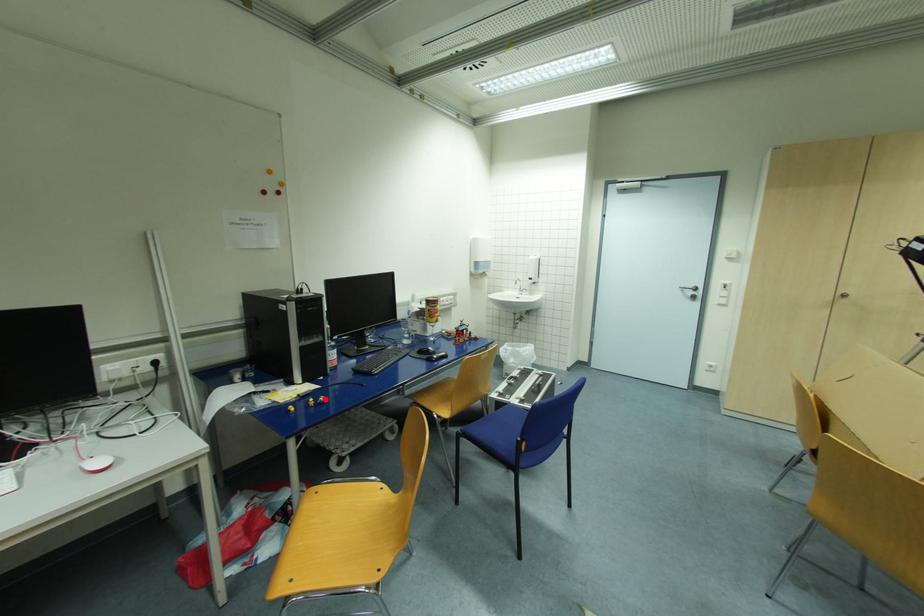
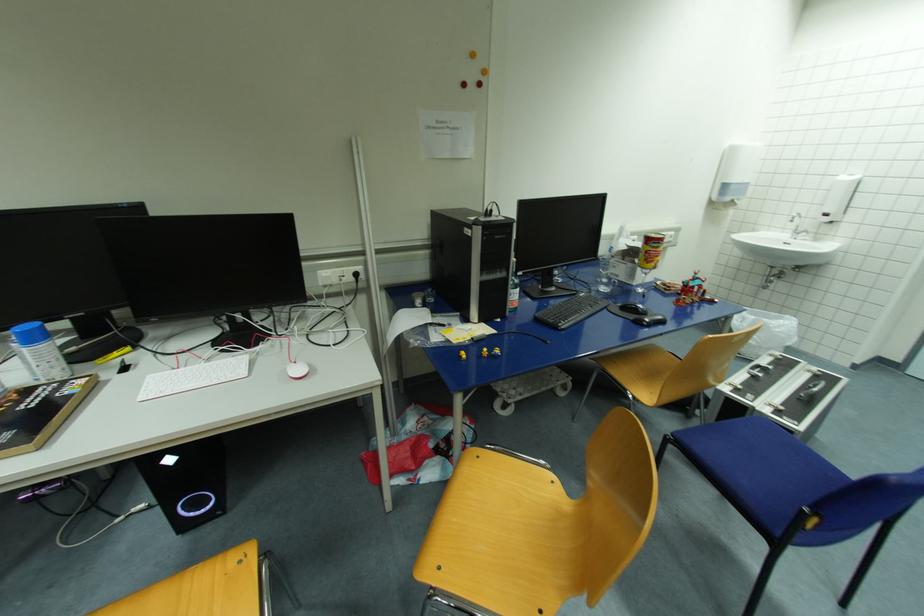
Locate, in the second image, the point that corresponds to the highlighted location in the first image.

(500, 352)